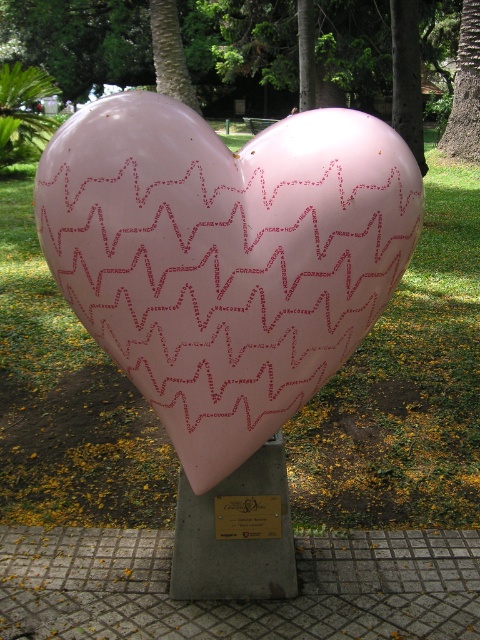
Question: Can you confirm if green leafy tree at center is positioned to the left of smooth brown tree trunk at right?

Choices:
 (A) yes
 (B) no

Answer: (A)

Question: Among these points, which one is nearest to the camera?

Choices:
 (A) (251, 524)
 (B) (181, 51)
 (C) (47, 65)

Answer: (A)

Question: Does green leafy tree at center appear over green textured palm tree at upper center?

Choices:
 (A) no
 (B) yes

Answer: (B)

Question: Considering the real-world distances, which object is farthest from the metallic gold plaque at center?

Choices:
 (A) green leafy tree at center
 (B) smooth brown tree trunk at right

Answer: (B)

Question: Which of the following is the farthest from the observer?

Choices:
 (A) smooth brown tree trunk at right
 (B) green leafy tree at center
 (C) metallic gold plaque at center
 (D) green textured palm tree at upper center

Answer: (A)

Question: Is green leafy tree at center wider than smooth brown tree trunk at right?

Choices:
 (A) no
 (B) yes

Answer: (B)